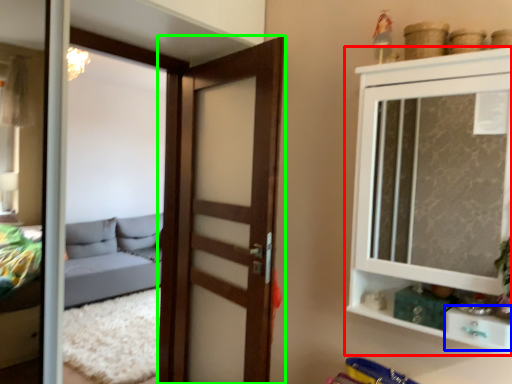
Question: Estimate the real-world distances between objects in this image. Which object is farther from cupboard (highlighted by a red box), drawer (highlighted by a blue box) or door (highlighted by a green box)?

Choices:
 (A) drawer
 (B) door

Answer: (B)